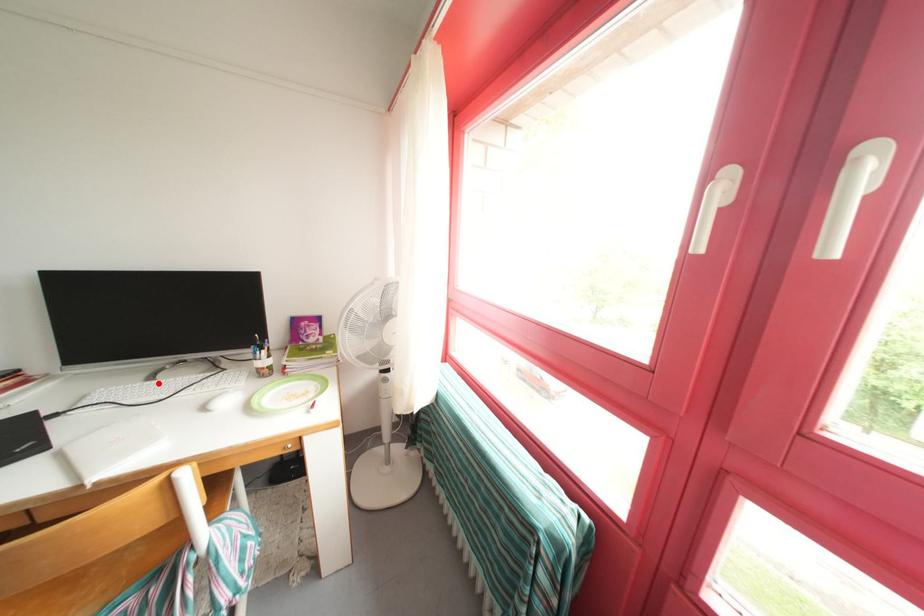
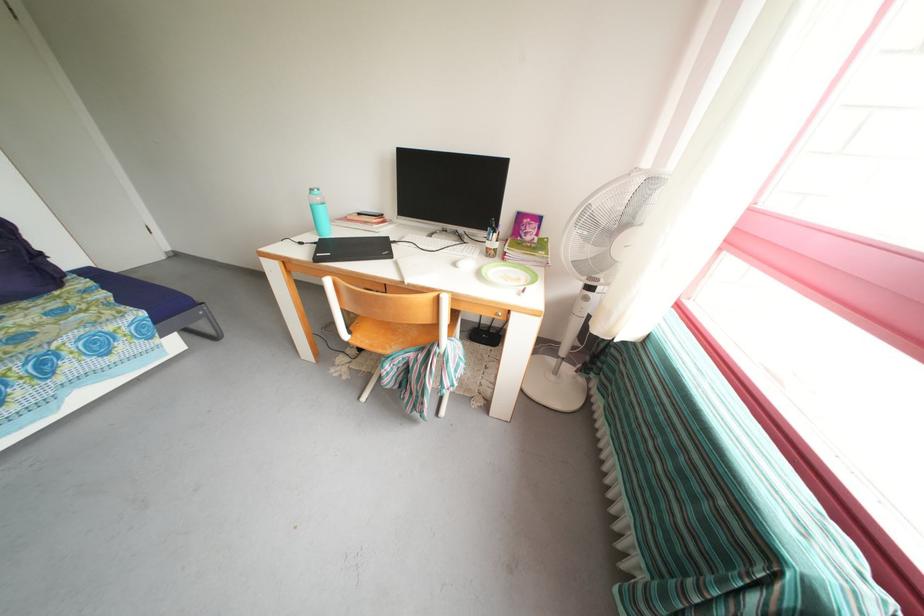
The point at the highlighted location is marked in the first image. Where is the corresponding point in the second image?

(436, 241)